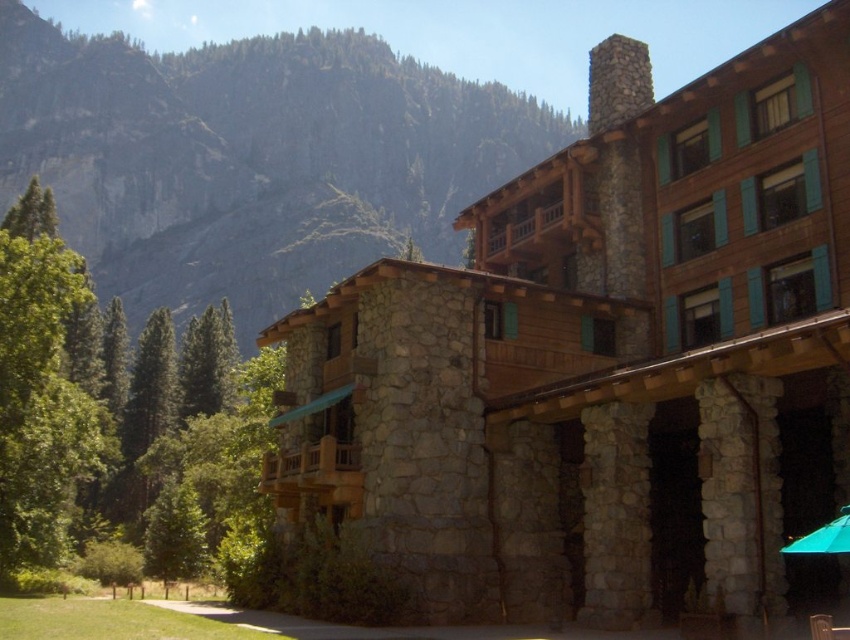
You are standing at the entrance of the lodge and want to sit down. Which object between the green leafy tree at lower left and the wooden chair at lower right is closer to you?

The wooden chair at lower right is closer to you because the green leafy tree at lower left is further away.